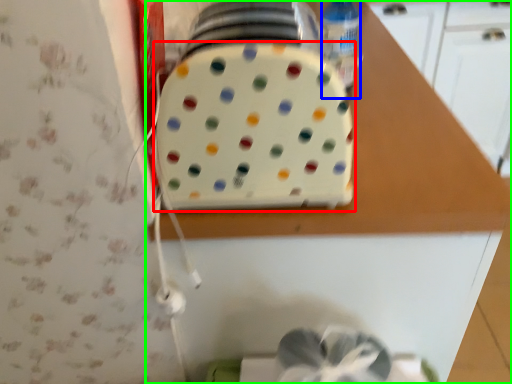
Question: Which is nearer to the toaster (highlighted by a red box)? bottle (highlighted by a blue box) or countertop (highlighted by a green box).

Choices:
 (A) bottle
 (B) countertop

Answer: (B)